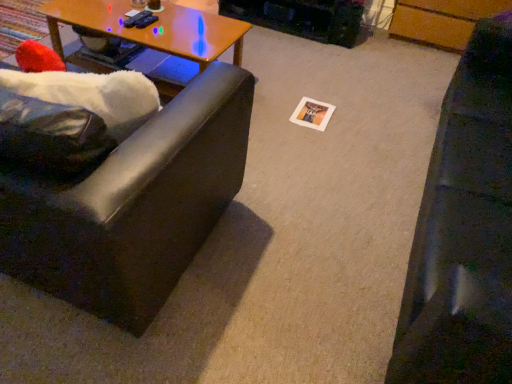
Identify the location of matte brown coffee cup at upper center. This screenshot has width=512, height=384. coord(154,5).

In order to face matte black couch at left, which is counted as the 2th studio couch, starting from the right, should I rotate leftwards or rightwards?

Rotate left and turn 28.090 degrees.

Describe the element at coordinates (153, 28) in the screenshot. I see `wooden at left` at that location.

Where is `black leather couch at right, the second studio couch positioned from the left`? black leather couch at right, the second studio couch positioned from the left is located at coordinates (464, 230).

Based on the photo, is wooden at left in front of or behind matte black couch at left, which is counted as the 2th studio couch, starting from the right, in the image?

Clearly, wooden at left is behind matte black couch at left, which is counted as the 2th studio couch, starting from the right.

Considering the sizes of objects wooden at left and matte black couch at left, which is counted as the 2th studio couch, starting from the right, in the image provided, who is shorter, wooden at left or matte black couch at left, which is counted as the 2th studio couch, starting from the right,?

Standing shorter between the two is wooden at left.

Is wooden at left touching matte black couch at left, which is counted as the first studio couch, starting from the left?

wooden at left is not next to matte black couch at left, which is counted as the first studio couch, starting from the left, and they're not touching.

Which is correct: matte brown coffee cup at upper center is inside wooden at left, or outside of it?

matte brown coffee cup at upper center exists outside the volume of wooden at left.

Does matte brown coffee cup at upper center lie in front of wooden at left?

No, matte brown coffee cup at upper center is further to the viewer.

Considering the relative positions of black leather couch at right, the second studio couch positioned from the left, and matte brown coffee cup at upper center in the image provided, is black leather couch at right, the second studio couch positioned from the left, to the left or to the right of matte brown coffee cup at upper center?

Clearly, black leather couch at right, the second studio couch positioned from the left, is on the right of matte brown coffee cup at upper center in the image.

Measure the distance from black leather couch at right, the second studio couch positioned from the left, to matte brown coffee cup at upper center.

A distance of 1.77 meters exists between black leather couch at right, the second studio couch positioned from the left, and matte brown coffee cup at upper center.

Which studio couch is the 2nd one when counting from the front of the matte brown coffee cup at upper center? Please provide its 2D coordinates.

[(464, 230)]

Is black leather couch at right, the second studio couch positioned from the left, completely or partially outside of matte brown coffee cup at upper center?

Yes.

From a real-world perspective, which studio couch is the 2nd one underneath the matte brown coffee cup at upper center? Please provide its 2D coordinates.

[(464, 230)]

Looking at their sizes, would you say matte brown coffee cup at upper center is wider or thinner than black leather couch at right, the second studio couch positioned from the left?

matte brown coffee cup at upper center is thinner than black leather couch at right, the second studio couch positioned from the left.

Can you confirm if matte brown coffee cup at upper center is smaller than black leather couch at right, the second studio couch positioned from the left?

Yes, matte brown coffee cup at upper center is smaller than black leather couch at right, the second studio couch positioned from the left.

Based on the photo, considering their positions, is matte brown coffee cup at upper center located in front of or behind black leather couch at right, which is counted as the 1th studio couch, starting from the right?

matte brown coffee cup at upper center is behind black leather couch at right, which is counted as the 1th studio couch, starting from the right.

Could you tell me if matte black couch at left, which is counted as the first studio couch, starting from the left, is facing black leather couch at right, the second studio couch positioned from the left?

No, matte black couch at left, which is counted as the first studio couch, starting from the left, is not turned towards black leather couch at right, the second studio couch positioned from the left.

Is matte black couch at left, which is counted as the 2th studio couch, starting from the right, positioned beyond the bounds of black leather couch at right, the second studio couch positioned from the left?

Absolutely, matte black couch at left, which is counted as the 2th studio couch, starting from the right, is external to black leather couch at right, the second studio couch positioned from the left.

Where is `studio couch located above the black leather couch at right, which is counted as the 1th studio couch, starting from the right (from the image's perspective)`? studio couch located above the black leather couch at right, which is counted as the 1th studio couch, starting from the right (from the image's perspective) is located at coordinates (133, 206).

Does matte black couch at left, which is counted as the first studio couch, starting from the left, appear on the left side of black leather couch at right, which is counted as the 1th studio couch, starting from the right?

Indeed, matte black couch at left, which is counted as the first studio couch, starting from the left, is positioned on the left side of black leather couch at right, which is counted as the 1th studio couch, starting from the right.

Would you say wooden at left is to the left or to the right of matte brown coffee cup at upper center in the picture?

In the image, wooden at left appears on the left side of matte brown coffee cup at upper center.

Locate an element on the screen. The image size is (512, 384). coffee cup lying on the right of wooden at left is located at coordinates (154, 5).

Is wooden at left facing away from matte brown coffee cup at upper center?

Result: No, wooden at left is not facing away from matte brown coffee cup at upper center.

Who is smaller, wooden at left or matte brown coffee cup at upper center?

matte brown coffee cup at upper center is smaller.

Can you confirm if matte black couch at left, which is counted as the 2th studio couch, starting from the right, is thinner than wooden at left?

No.

Is there a large distance between matte black couch at left, which is counted as the 2th studio couch, starting from the right, and wooden at left?

matte black couch at left, which is counted as the 2th studio couch, starting from the right, is positioned a significant distance from wooden at left.

Based on the photo, is matte black couch at left, which is counted as the 2th studio couch, starting from the right, facing towards wooden at left?

Yes, matte black couch at left, which is counted as the 2th studio couch, starting from the right, is facing wooden at left.

Could wooden at left be considered to be inside matte black couch at left, which is counted as the 2th studio couch, starting from the right?

No, wooden at left is not surrounded by matte black couch at left, which is counted as the 2th studio couch, starting from the right.

The height and width of the screenshot is (384, 512). I want to click on the 1st studio couch in front when counting from the wooden at left, so click(133, 206).

Identify the location of coffee cup located above the wooden at left (from the image's perspective). The height and width of the screenshot is (384, 512). (154, 5).

Based on their spatial positions, is wooden at left or matte black couch at left, which is counted as the first studio couch, starting from the left, further from black leather couch at right, the second studio couch positioned from the left?

wooden at left is positioned further to the anchor black leather couch at right, the second studio couch positioned from the left.

Considering their positions, is black leather couch at right, which is counted as the 1th studio couch, starting from the right, positioned closer to wooden at left than matte black couch at left, which is counted as the first studio couch, starting from the left?

matte black couch at left, which is counted as the first studio couch, starting from the left, lies closer to wooden at left than the other object.

Looking at the image, which one is located closer to wooden at left, matte brown coffee cup at upper center or black leather couch at right, the second studio couch positioned from the left?

matte brown coffee cup at upper center lies closer to wooden at left than the other object.

Which object lies nearer to the anchor point matte black couch at left, which is counted as the first studio couch, starting from the left, matte brown coffee cup at upper center or wooden at left?

The object closer to matte black couch at left, which is counted as the first studio couch, starting from the left, is wooden at left.

Based on their spatial positions, is wooden at left or black leather couch at right, the second studio couch positioned from the left, closer to matte black couch at left, which is counted as the 2th studio couch, starting from the right?

The object closer to matte black couch at left, which is counted as the 2th studio couch, starting from the right, is black leather couch at right, the second studio couch positioned from the left.

In the scene shown: Based on their spatial positions, is matte black couch at left, which is counted as the first studio couch, starting from the left, or black leather couch at right, which is counted as the 1th studio couch, starting from the right, further from wooden at left?

black leather couch at right, which is counted as the 1th studio couch, starting from the right, lies further to wooden at left than the other object.

Considering their positions, is black leather couch at right, the second studio couch positioned from the left, positioned further to wooden at left than matte brown coffee cup at upper center?

The object further to wooden at left is black leather couch at right, the second studio couch positioned from the left.

Which object lies further to the anchor point matte brown coffee cup at upper center, wooden at left or matte black couch at left, which is counted as the 2th studio couch, starting from the right?

matte black couch at left, which is counted as the 2th studio couch, starting from the right, is further to matte brown coffee cup at upper center.

Where is `coffee table located between matte black couch at left, which is counted as the first studio couch, starting from the left, and matte brown coffee cup at upper center in the depth direction`? The image size is (512, 384). coffee table located between matte black couch at left, which is counted as the first studio couch, starting from the left, and matte brown coffee cup at upper center in the depth direction is located at coordinates (153, 28).

This screenshot has width=512, height=384. What are the coordinates of `coffee cup between wooden at left and black leather couch at right, the second studio couch positioned from the left, from left to right` in the screenshot? It's located at (154, 5).

What are the coordinates of `coffee cup situated between matte black couch at left, which is counted as the first studio couch, starting from the left, and black leather couch at right, which is counted as the 1th studio couch, starting from the right, from left to right` in the screenshot? It's located at (154, 5).

At what (x,y) coordinates should I click in order to perform the action: click on coffee table located between matte black couch at left, which is counted as the first studio couch, starting from the left, and black leather couch at right, the second studio couch positioned from the left, in the left-right direction. Please return your answer as a coordinate pair (x, y). The image size is (512, 384). Looking at the image, I should click on (153, 28).